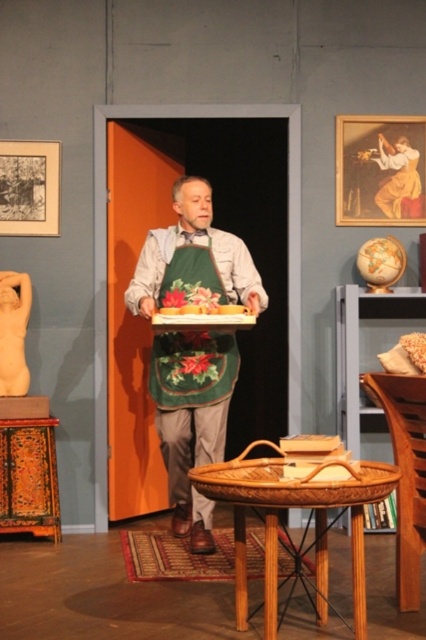
You are a stagehand setting up for a play and need to place a prop basket. The director wants to ensure the green felt apron at center is visible to the audience. Where should the wooden wicker basket at lower left be positioned relative to the apron?

The wooden wicker basket at lower left should be placed below the green felt apron at center so that the apron remains visible above it.

You are a guest at a dinner party and need to find a place to sit. You see a woven wood chair at lower right and a wooden wicker basket at lower left. Which object is positioned to the right side of the room?

The woven wood chair at lower right is positioned to the right side of the room because it is to the right of the wooden wicker basket at lower left.

You are a stage designer preparing for a play and need to ensure that the green felt apron at center and the wooden wicker basket at lower left are visible to the audience. Given their sizes, which object might require a more elevated position to ensure visibility?

The green felt apron at center is larger in size than the wooden wicker basket at lower left, so the smaller wooden wicker basket at lower left might need to be placed on a higher surface to ensure it is visible to the audience.